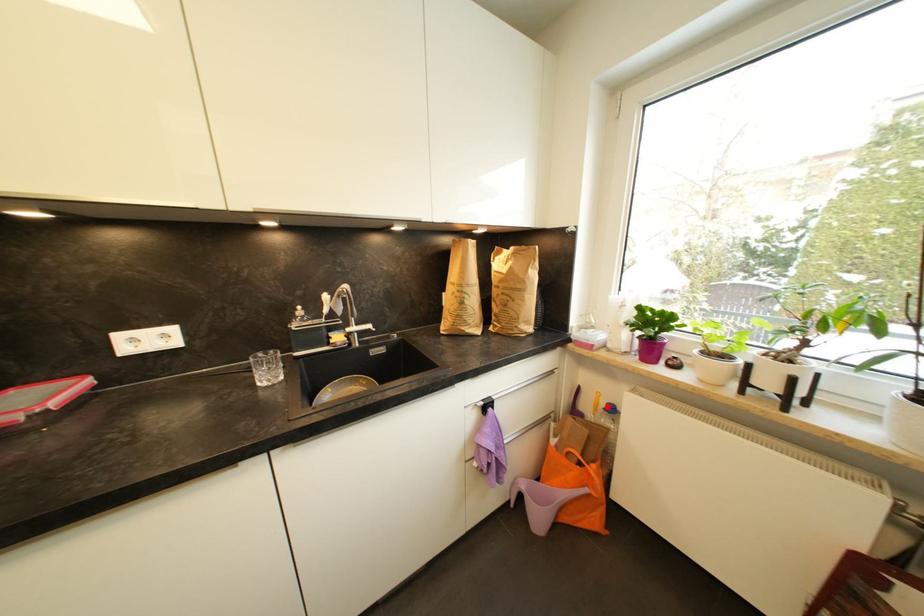
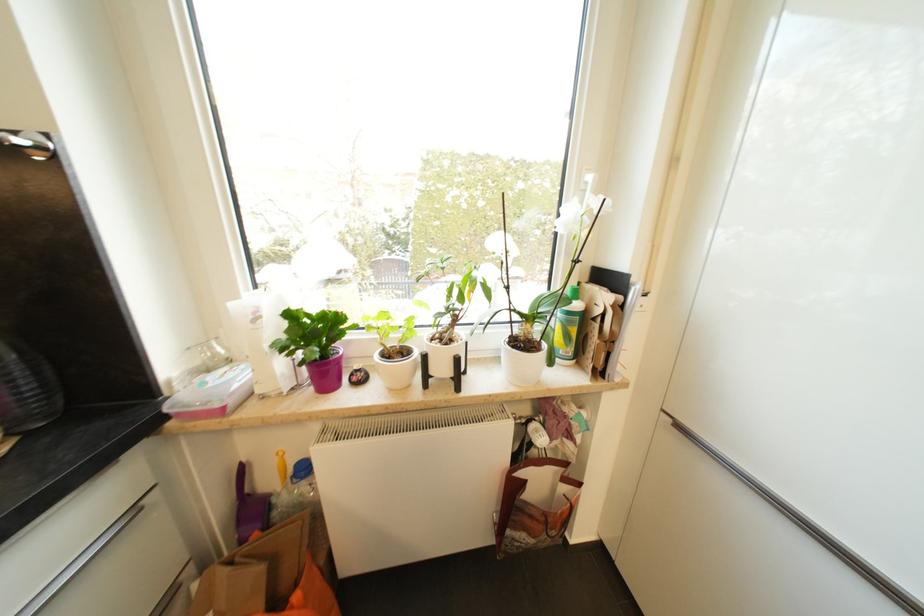
Question: I am providing you with two images of the same scene from different viewpoints. A red point is shown in image1. For the corresponding object point in image2, is it positioned nearer or farther from the camera?

Choices:
 (A) Nearer
 (B) Farther

Answer: (B)